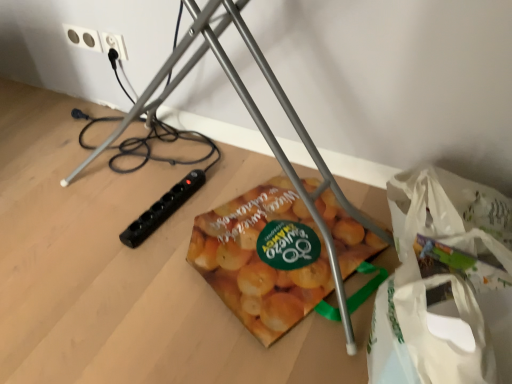
Question: Is white plastic bag at lower right touching metallic tripod at center?

Choices:
 (A) yes
 (B) no

Answer: (B)

Question: Is white plastic bag at lower right in front of metallic tripod at center?

Choices:
 (A) yes
 (B) no

Answer: (A)

Question: Considering the relative sizes of white plastic bag at lower right and metallic tripod at center in the image provided, is white plastic bag at lower right shorter than metallic tripod at center?

Choices:
 (A) yes
 (B) no

Answer: (B)

Question: From the image's perspective, is white plastic bag at lower right on metallic tripod at center?

Choices:
 (A) yes
 (B) no

Answer: (B)

Question: Would you say metallic tripod at center is part of white plastic bag at lower right's contents?

Choices:
 (A) no
 (B) yes

Answer: (A)

Question: Based on their positions, is white plastic bag at lower right located to the left or right of metallic tripod at center?

Choices:
 (A) left
 (B) right

Answer: (B)

Question: Is point (493, 248) positioned closer to the camera than point (269, 72)?

Choices:
 (A) closer
 (B) farther

Answer: (B)

Question: From a real-world perspective, is white plastic bag at lower right physically located above or below metallic tripod at center?

Choices:
 (A) above
 (B) below

Answer: (A)

Question: Considering the positions of white plastic bag at lower right and metallic tripod at center in the image, is white plastic bag at lower right bigger or smaller than metallic tripod at center?

Choices:
 (A) big
 (B) small

Answer: (B)

Question: Visually, is metallic tripod at center positioned to the left or to the right of white plastic bag at lower right?

Choices:
 (A) right
 (B) left

Answer: (B)

Question: Is point (123, 127) closer or farther from the camera than point (495, 248)?

Choices:
 (A) closer
 (B) farther

Answer: (B)

Question: Considering their positions, is metallic tripod at center located in front of or behind white plastic bag at lower right?

Choices:
 (A) front
 (B) behind

Answer: (B)

Question: Choose the correct answer: Is metallic tripod at center inside white plastic bag at lower right or outside it?

Choices:
 (A) inside
 (B) outside

Answer: (B)

Question: From the image's perspective, is black plastic power plug at upper left, acting as the second power plugs and sockets starting from the left, positioned above or below white plastic bag at lower right?

Choices:
 (A) above
 (B) below

Answer: (A)

Question: Is black plastic power plug at upper left, marked as the first power plugs and sockets in a right-to-left arrangement, spatially inside white plastic bag at lower right, or outside of it?

Choices:
 (A) inside
 (B) outside

Answer: (B)